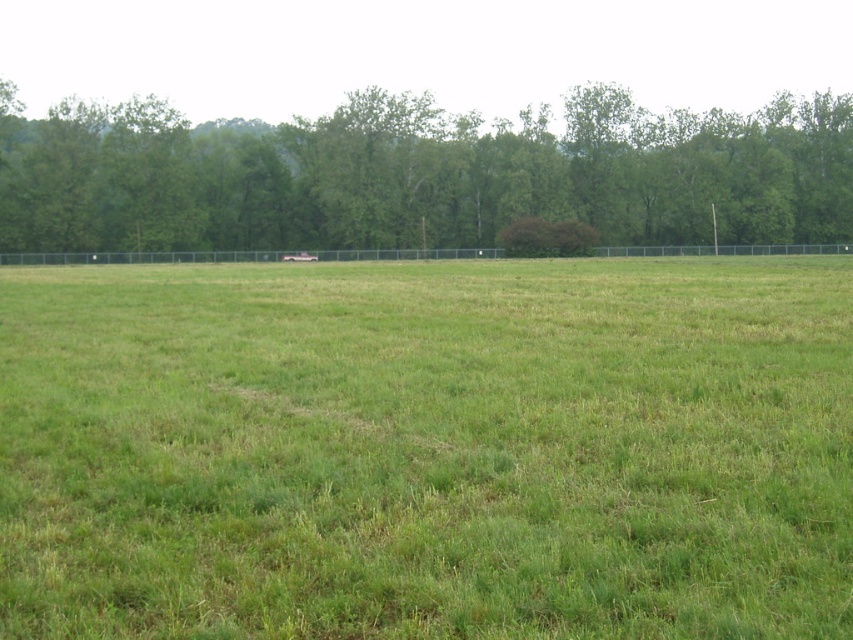
Question: Is green grassy field at center to the right of green leafy tree at upper center from the viewer's perspective?

Choices:
 (A) yes
 (B) no

Answer: (B)

Question: Is green grassy field at center thinner than green leafy tree at upper center?

Choices:
 (A) yes
 (B) no

Answer: (A)

Question: Does green grassy field at center lie in front of green leafy tree at upper center?

Choices:
 (A) yes
 (B) no

Answer: (A)

Question: Which point appears farthest from the camera in this image?

Choices:
 (A) (538, 186)
 (B) (120, 336)

Answer: (A)

Question: Among these points, which one is farthest from the camera?

Choices:
 (A) (664, 378)
 (B) (605, 172)

Answer: (B)